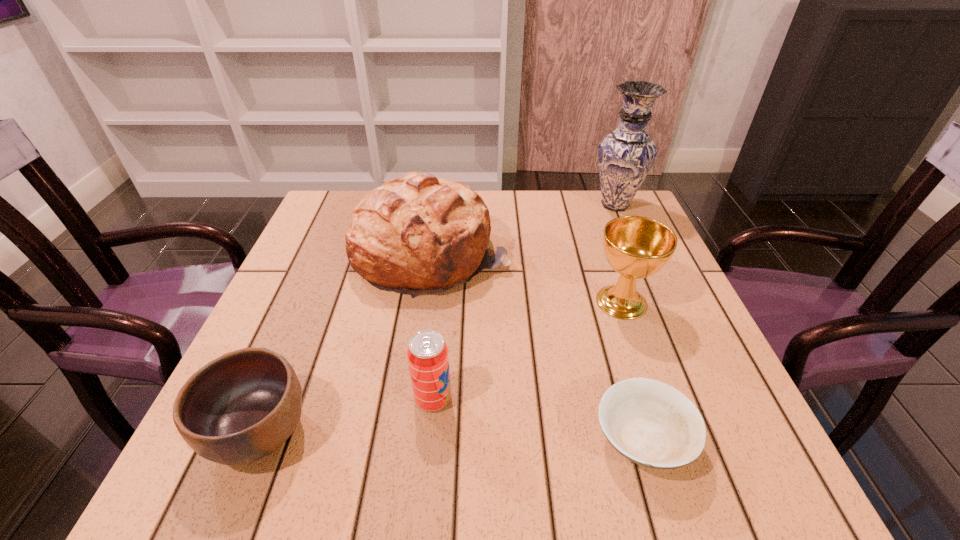
You are a GUI agent. You are given a task and a screenshot of the screen. Output one action in this format:
    pyautogui.click(x=<x>, y=<y>)
    Task: Click on the free space located on the back of the chalice
    This screenshot has height=540, width=960.
    Given the screenshot: What is the action you would take?
    pyautogui.click(x=596, y=230)

The width and height of the screenshot is (960, 540). Identify the location of vacant space positioned on the back of the third shortest object. (443, 298).

This screenshot has width=960, height=540. Find the location of `vacant space situated 0.060m on the back of the left bowl`. vacant space situated 0.060m on the back of the left bowl is located at coordinates (289, 360).

At what (x,y) coordinates should I click in order to perform the action: click on blank space located 0.100m on the left of the shortest object. Please return your answer as a coordinate pair (x, y). Looking at the image, I should click on (530, 440).

The height and width of the screenshot is (540, 960). Find the location of `vase located at the far edge`. vase located at the far edge is located at coordinates (625, 156).

Image resolution: width=960 pixels, height=540 pixels. Find the location of `bread present at the far edge`. bread present at the far edge is located at coordinates (415, 234).

Where is `bread located at the left edge`? The width and height of the screenshot is (960, 540). bread located at the left edge is located at coordinates (415, 234).

The image size is (960, 540). In order to click on bowl present at the left edge in this screenshot , I will do `click(242, 406)`.

The width and height of the screenshot is (960, 540). I want to click on vase that is at the right edge, so click(x=625, y=156).

Where is `chalice located in the right edge section of the desktop`? The width and height of the screenshot is (960, 540). chalice located in the right edge section of the desktop is located at coordinates (636, 247).